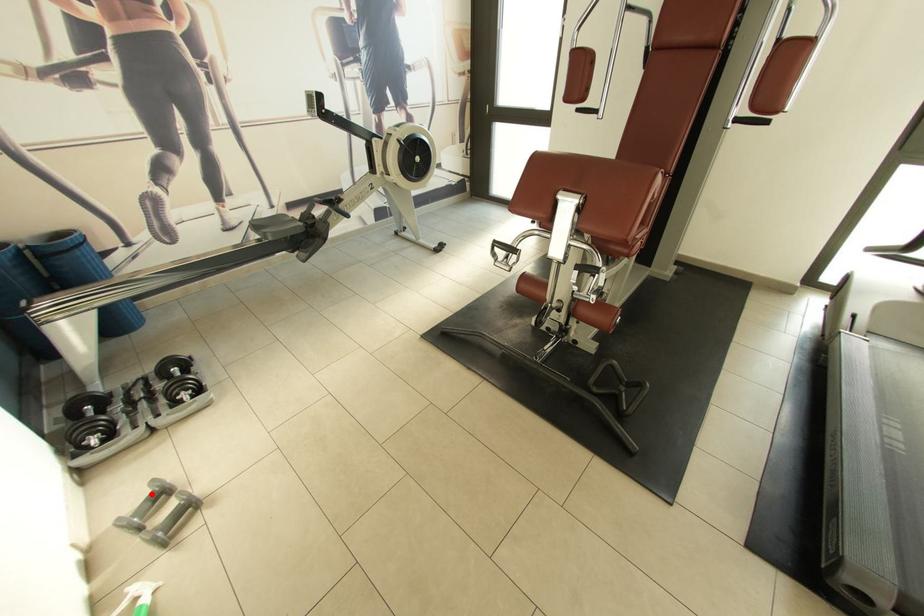
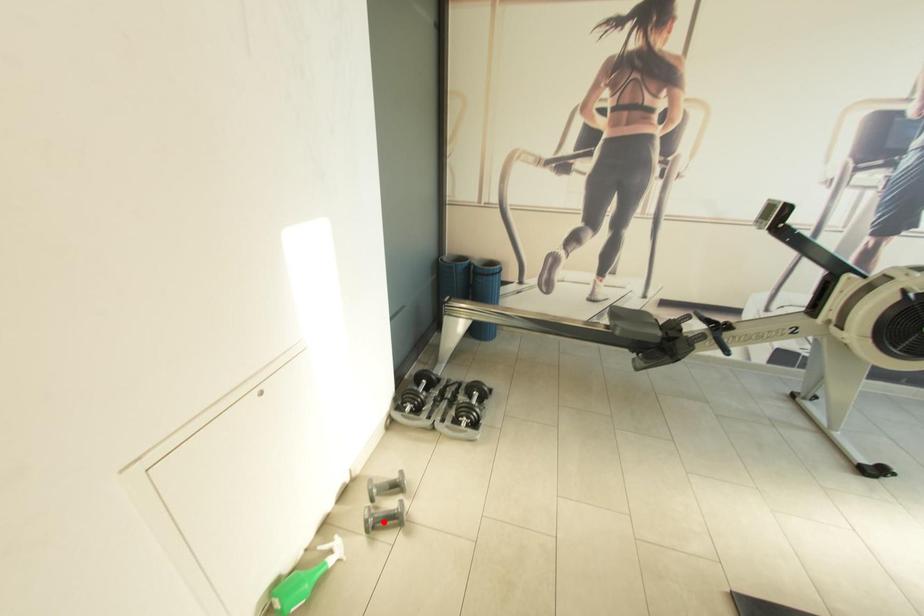
I am providing you with two images of the same scene from different viewpoints. A red point is marked on the first image and another point is marked on the second image. Is the marked point in image1 the same physical position as the marked point in image2?

No